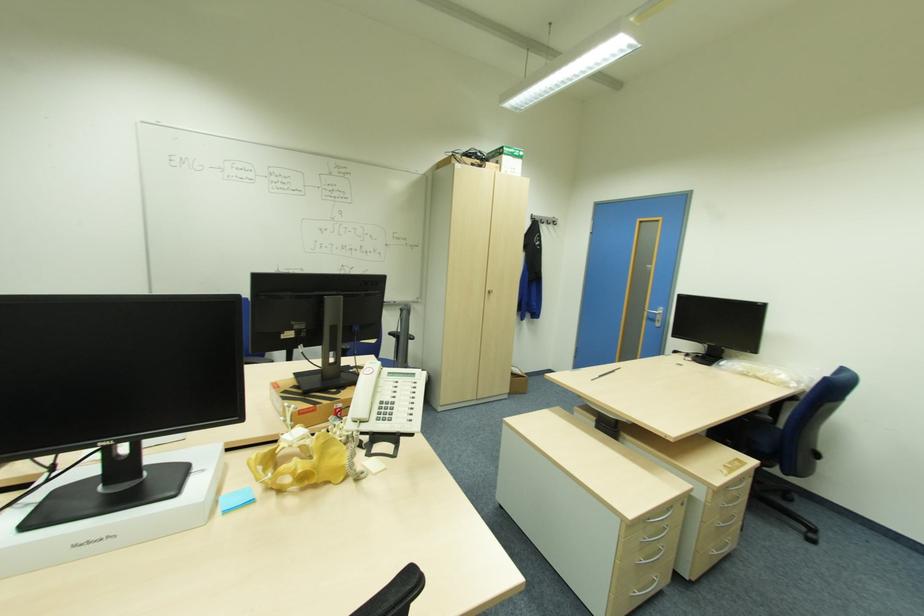
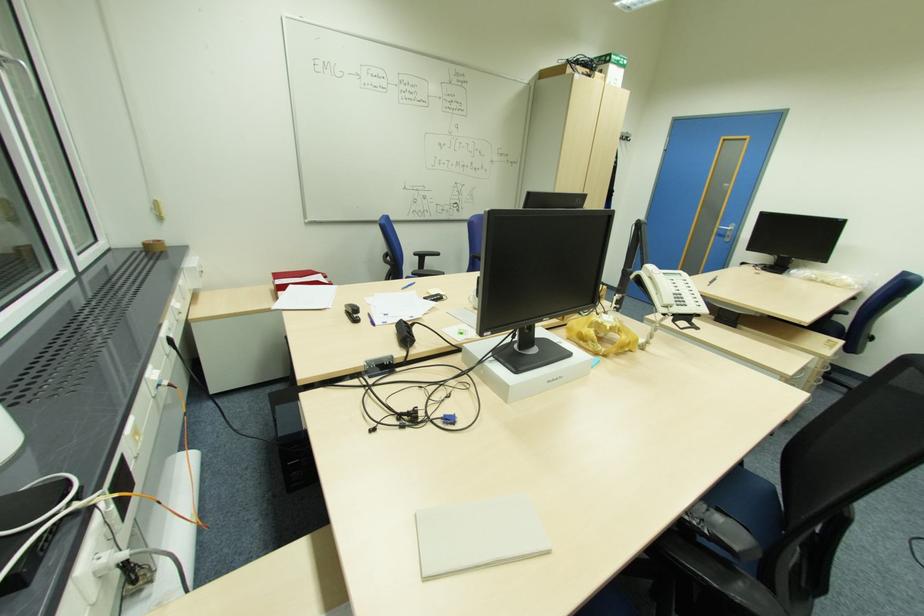
In the second image, find the point that corresponds to (359,422) in the first image.

(670, 306)